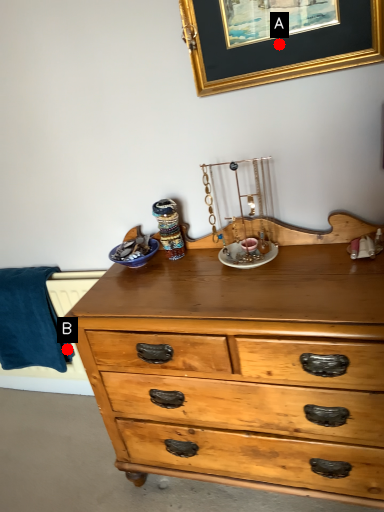
Question: Two points are circled on the image, labeled by A and B beside each circle. Which of the following is the closest to the observer?

Choices:
 (A) A is closer
 (B) B is closer

Answer: (A)